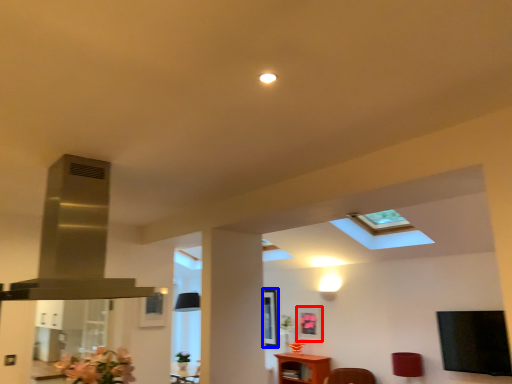
Question: Among these objects, which one is nearest to the camera, picture frame (highlighted by a red box) or picture frame (highlighted by a blue box)?

Choices:
 (A) picture frame
 (B) picture frame

Answer: (A)